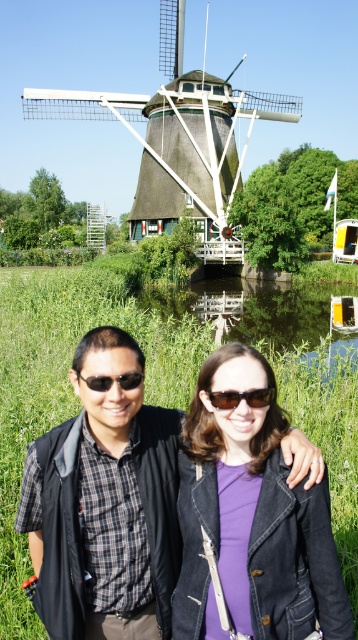
Question: Among these points, which one is farthest from the camera?

Choices:
 (A) (147, 584)
 (B) (269, 452)
 (C) (218, 404)

Answer: (A)

Question: Which object is positioned farthest from the black plastic sunglasses at center?

Choices:
 (A) sunglasses at center
 (B) matte black vest at center
 (C) thatched roof windmill at upper center

Answer: (C)

Question: Which of the following is the farthest from the observer?

Choices:
 (A) sunglasses at center
 (B) purple denim jacket at center
 (C) thatched roof windmill at upper center
 (D) matte black vest at center

Answer: (C)

Question: Does green grass at lower left appear on the right side of matte black vest at center?

Choices:
 (A) no
 (B) yes

Answer: (A)

Question: Can you confirm if green grass at lower left is bigger than sunglasses at center?

Choices:
 (A) yes
 (B) no

Answer: (A)

Question: Does purple denim jacket at center appear over black plastic sunglasses at center?

Choices:
 (A) yes
 (B) no

Answer: (B)